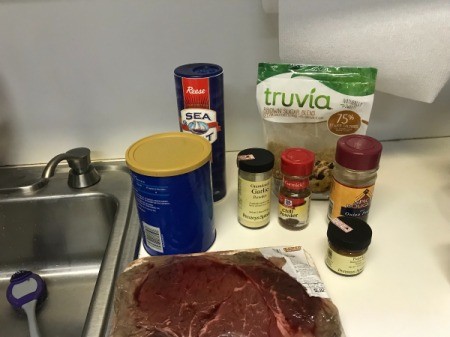
This screenshot has width=450, height=337. What are the coordinates of `soap dispenser` in the screenshot? It's located at (82, 159).